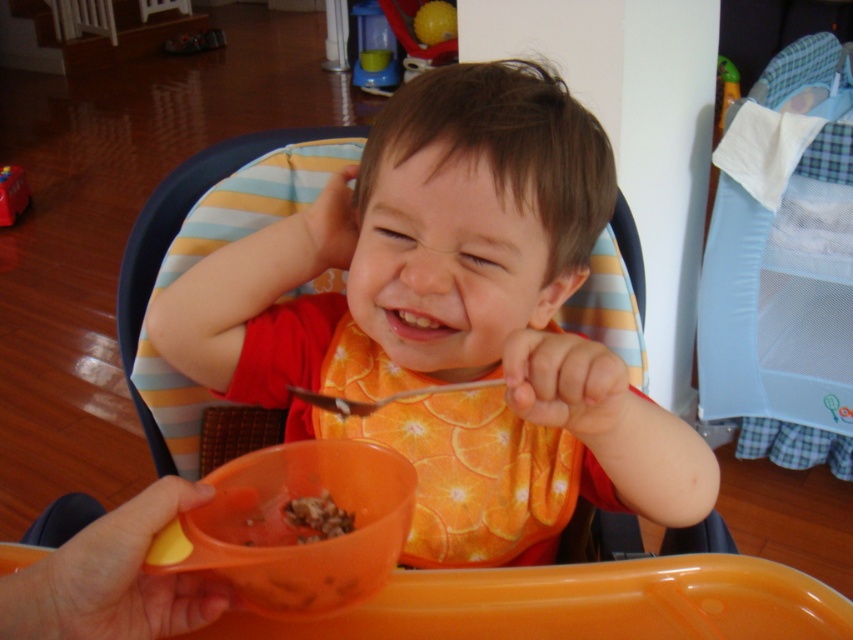
Question: Which object is positioned farthest from the brown crumbly food at center?

Choices:
 (A) orange fabric bib at center
 (B) orange plastic bowl at lower center

Answer: (A)

Question: In this image, where is brown crumbly food at center located relative to metallic silver spoon at upper center?

Choices:
 (A) below
 (B) above

Answer: (A)

Question: Does orange fabric bib at center appear under brown crumbly food at center?

Choices:
 (A) no
 (B) yes

Answer: (A)

Question: In this image, where is orange fabric bib at center located relative to brown crumbly food at center?

Choices:
 (A) right
 (B) left

Answer: (A)

Question: Which point is farther from the camera taking this photo?

Choices:
 (A) (402, 390)
 (B) (280, 563)
 (C) (310, 540)
 (D) (190, 275)

Answer: (D)

Question: Which point is closer to the camera?

Choices:
 (A) metallic silver spoon at upper center
 (B) orange plastic bowl at lower center
 (C) orange fabric bib at center

Answer: (B)